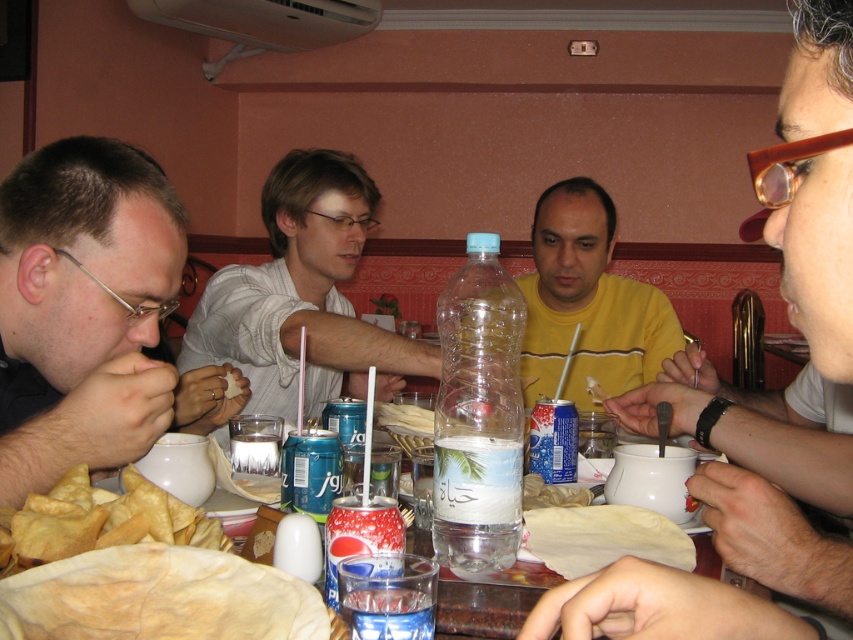
Question: Can you confirm if clear plastic bottle at center is positioned below white paper napkin at center?

Choices:
 (A) yes
 (B) no

Answer: (B)

Question: Is brown/crumbly flatbread at lower left to the right of white paper napkin at center from the viewer's perspective?

Choices:
 (A) no
 (B) yes

Answer: (A)

Question: Which of the following is the farthest from the observer?

Choices:
 (A) click(x=378, y=612)
 (B) click(x=289, y=609)
 (C) click(x=817, y=262)

Answer: (A)

Question: Does matte black shirt at left have a smaller size compared to brown/crumbly flatbread at lower left?

Choices:
 (A) no
 (B) yes

Answer: (A)

Question: Which object is positioned closest to the yellow matte shirt at center?

Choices:
 (A) clear plastic bottle at center
 (B) brown/crumbly flatbread at lower left

Answer: (A)

Question: Which of the following is the farthest from the observer?

Choices:
 (A) (392, 417)
 (B) (335, 179)

Answer: (B)